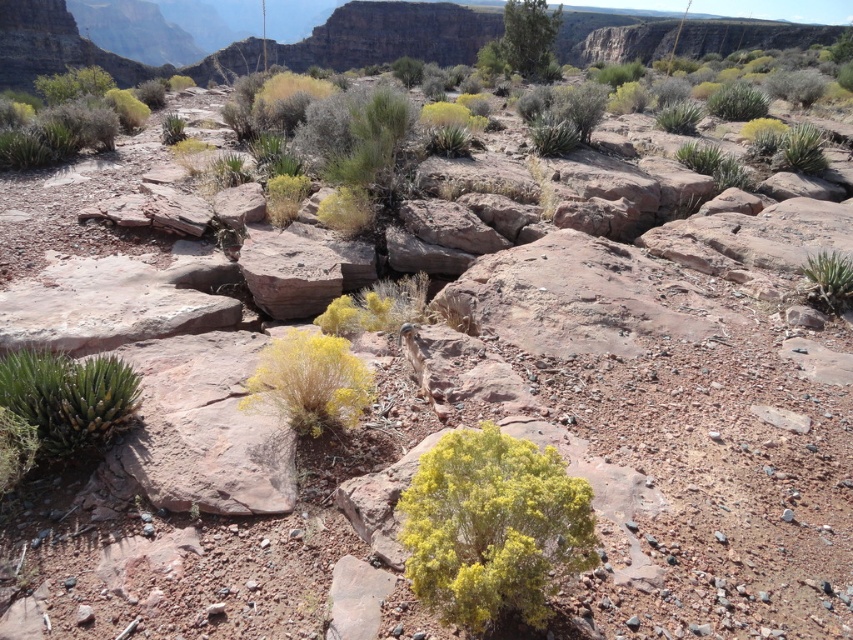
You are a hiker who has just arrived at this desert landscape. You notice a green leafy tree at upper right and a green fuzzy plant at right. Which one would you estimate is taller?

The green leafy tree at upper right is taller than the green fuzzy plant at right.

You are a botanist studying plants in this desert canyon. You need to determine which plant has a wider spread between the yellow fluffy bush at center and the green fuzzy plant at right. Which one is wider?

The yellow fluffy bush at center is wider than the green fuzzy plant at right because its width surpasses the latter.